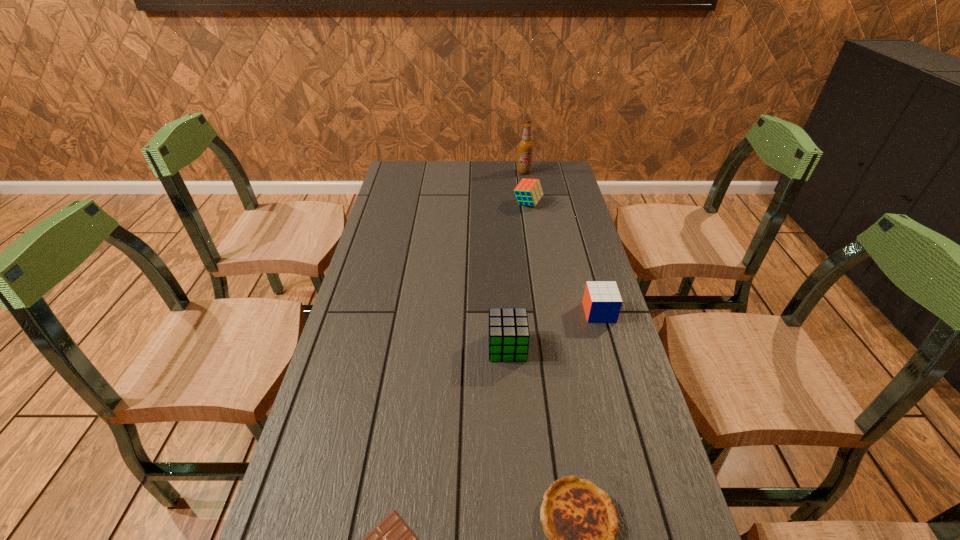
Locate an element on the screen. The image size is (960, 540). vacant region between the fourth farthest object and the beer bottle is located at coordinates (516, 260).

In order to click on empty space between the fourth tallest object and the tallest object in this screenshot , I will do `click(562, 242)`.

Locate which object ranks second in proximity to the beer bottle. Please provide its 2D coordinates. Your answer should be formatted as a tuple, i.e. [(x, y)], where the tuple contains the x and y coordinates of a point satisfying the conditions above.

[(602, 302)]

Where is `object that is the second closest to the fourth farthest object`? object that is the second closest to the fourth farthest object is located at coordinates coord(580,521).

Identify which cube is located as the nearest to the second cube from right to left. Please provide its 2D coordinates. Your answer should be formatted as a tuple, i.e. [(x, y)], where the tuple contains the x and y coordinates of a point satisfying the conditions above.

[(602, 302)]

Where is `cube that is the second closest one to the beer bottle`? The image size is (960, 540). cube that is the second closest one to the beer bottle is located at coordinates (602, 302).

Where is `blank space that satisfies the following two spatial constraints: 1. on the back side of the farthest cube; 2. on the left side of the leftmost cube`? The height and width of the screenshot is (540, 960). blank space that satisfies the following two spatial constraints: 1. on the back side of the farthest cube; 2. on the left side of the leftmost cube is located at coordinates (498, 204).